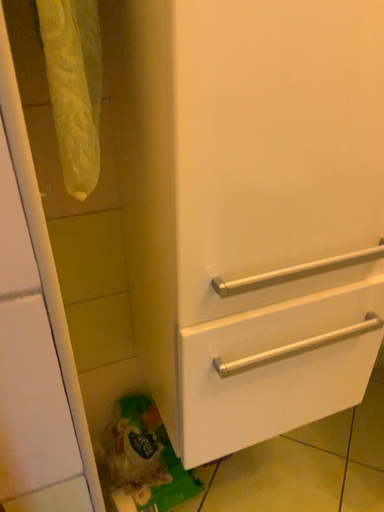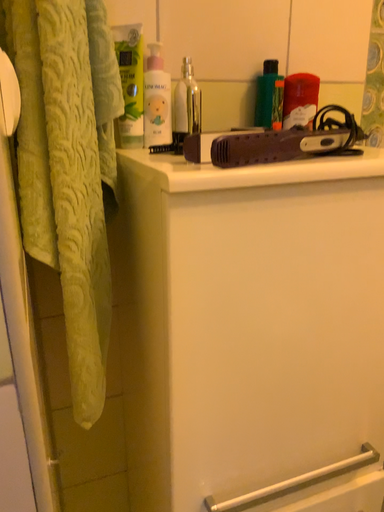
Question: How did the camera likely rotate when shooting the video?

Choices:
 (A) rotated downward
 (B) rotated upward

Answer: (B)